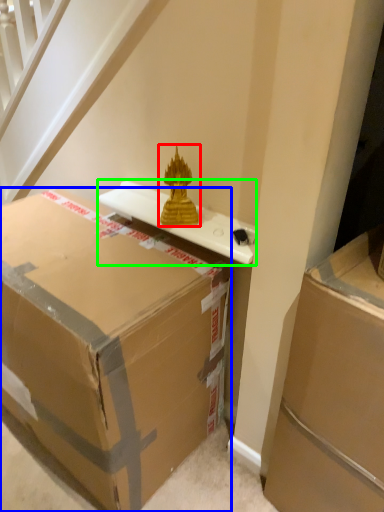
Question: Estimate the real-world distances between objects in this image. Which object is farther from sculpture (highlighted by a red box), box (highlighted by a blue box) or table (highlighted by a green box)?

Choices:
 (A) box
 (B) table

Answer: (A)